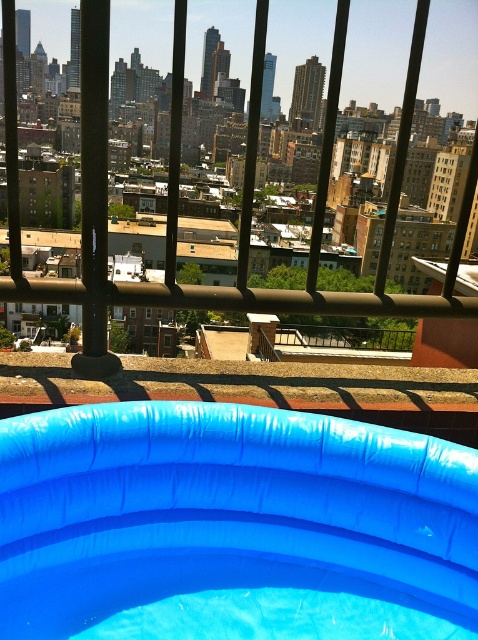
You are standing on a balcony and see two blue rubber pools in the image. Which one is closer to you, the blue rubber pool at center or the blue rubber pool at lower center?

The blue rubber pool at center is closer to you because it is positioned in front of the blue rubber pool at lower center.